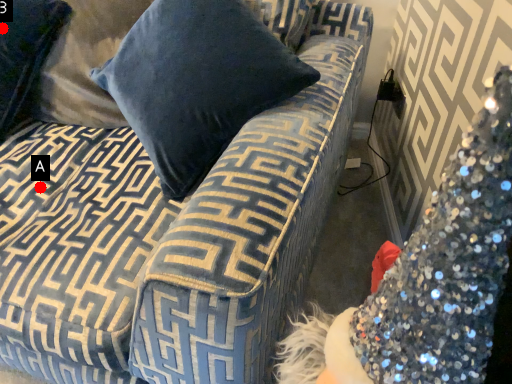
Question: Two points are circled on the image, labeled by A and B beside each circle. Which of the following is the farthest from the observer?

Choices:
 (A) A is further
 (B) B is further

Answer: (B)